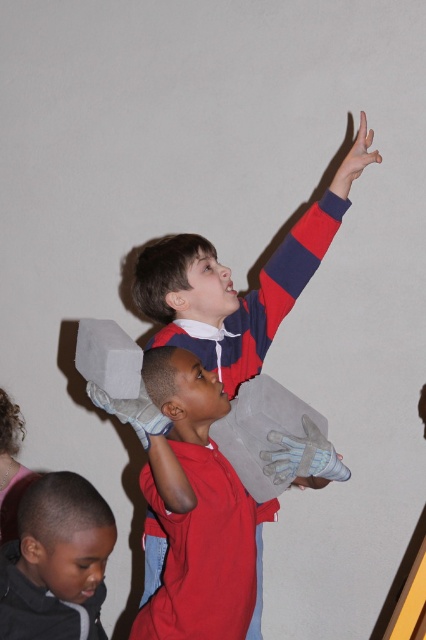
You are organizing a school event and need to place a rectangular box that is 1 meter wide between the black matte jacket at lower left and the white mesh glove at upper right. Based on their sizes, will the box fit between them?

The black matte jacket at lower left is wider than the white mesh glove at upper right. Since the box is 1 meter wide, we need to know the exact width of the space between them to determine if it fits. However, the description only compares their widths, not the distance between them. Therefore, it is impossible to confirm if the box will fit based on the given information.

You are a teacher observing the children playing with foam blocks. You notice the matte red and blue striped sleeve at upper right and the smooth skin hand at upper right. Which object is wider?

The matte red and blue striped sleeve at upper right is wider than the smooth skin hand at upper right.

You are a photographer trying to capture a candid shot of the children playing with the foam blocks. You want to frame the shot so that the black matte jacket at lower left and the smooth skin hand at upper right are both visible. Which object should you adjust your camera angle to prioritize in terms of width to ensure both are in frame?

The black matte jacket at lower left is wider than the smooth skin hand at upper right, so you should prioritize framing the black matte jacket at lower left first to ensure both objects fit within the camera frame.